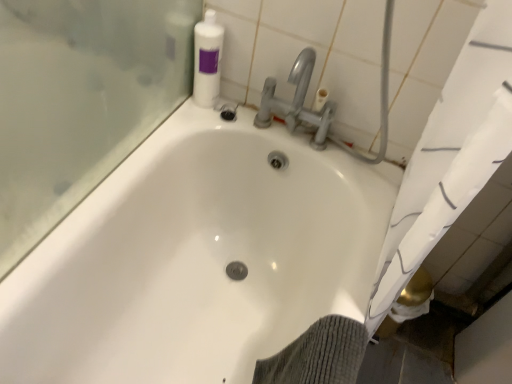
Question: Does white glossy bathtub at center have a larger size compared to white plastic bottle at upper right?

Choices:
 (A) yes
 (B) no

Answer: (A)

Question: From a real-world perspective, is white glossy bathtub at center on white plastic bottle at upper right?

Choices:
 (A) yes
 (B) no

Answer: (B)

Question: From the image's perspective, is white glossy bathtub at center located above white plastic bottle at upper right?

Choices:
 (A) yes
 (B) no

Answer: (B)

Question: Is white glossy bathtub at center outside white plastic bottle at upper right?

Choices:
 (A) yes
 (B) no

Answer: (A)

Question: Is white glossy bathtub at center positioned far away from white plastic bottle at upper right?

Choices:
 (A) no
 (B) yes

Answer: (A)

Question: Does white glossy bathtub at center come in front of white plastic bottle at upper right?

Choices:
 (A) yes
 (B) no

Answer: (A)

Question: Considering the relative sizes of white plastic bottle at upper right and white glossy bathtub at center in the image provided, is white plastic bottle at upper right bigger than white glossy bathtub at center?

Choices:
 (A) no
 (B) yes

Answer: (A)

Question: Is white plastic bottle at upper right far away from white glossy bathtub at center?

Choices:
 (A) no
 (B) yes

Answer: (A)

Question: Can white glossy bathtub at center be found inside white plastic bottle at upper right?

Choices:
 (A) yes
 (B) no

Answer: (B)

Question: Considering the relative sizes of white plastic bottle at upper right and white glossy bathtub at center in the image provided, is white plastic bottle at upper right wider than white glossy bathtub at center?

Choices:
 (A) no
 (B) yes

Answer: (A)

Question: From the image's perspective, is white plastic bottle at upper right under white glossy bathtub at center?

Choices:
 (A) no
 (B) yes

Answer: (A)

Question: From the image's perspective, would you say white plastic bottle at upper right is positioned over white glossy bathtub at center?

Choices:
 (A) no
 (B) yes

Answer: (B)

Question: Considering the positions of white plastic bottle at upper right and white glossy bathtub at center in the image, is white plastic bottle at upper right wider or thinner than white glossy bathtub at center?

Choices:
 (A) wide
 (B) thin

Answer: (B)